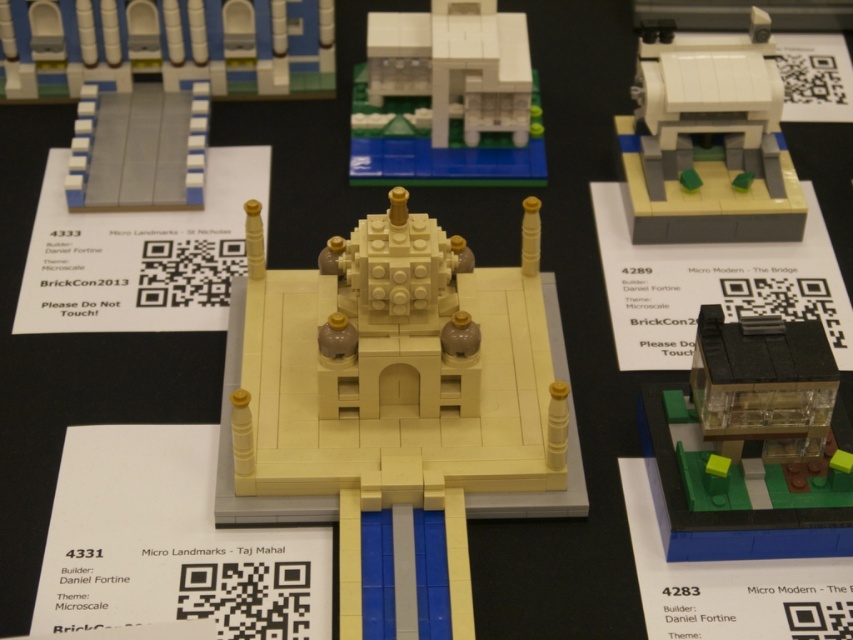
You are a LEGO enthusiast examining the display. You notice the transparent plastic house at lower right and the white matte building at upper center. Which one appears nearer to you?

The transparent plastic house at lower right is closer to the viewer than the white matte building at upper center.

You are a LEGO enthusiast examining the displayed models. You notice the beige matte taj mahal at center and the white matte house at upper right. Which model has a greater height?

The beige matte taj mahal at center is much taller than the white matte house at upper right, so the beige matte taj mahal at center has a greater height.

You are a LEGO enthusiast examining the display. You notice the beige matte taj mahal at center and the white matte building at upper left. Which of these two LEGO models is taller?

The beige matte taj mahal at center is much taller than the white matte building at upper left.